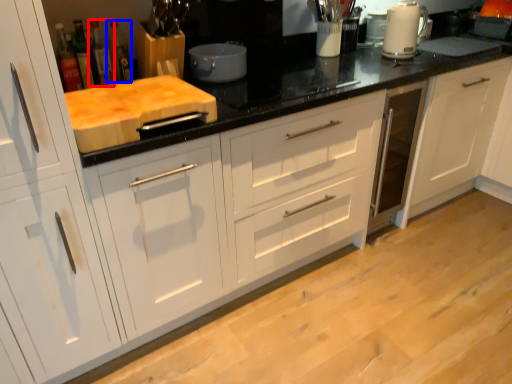
Question: Which point is closer to the camera, bottle (highlighted by a red box) or bottle (highlighted by a blue box)?

Choices:
 (A) bottle
 (B) bottle

Answer: (A)